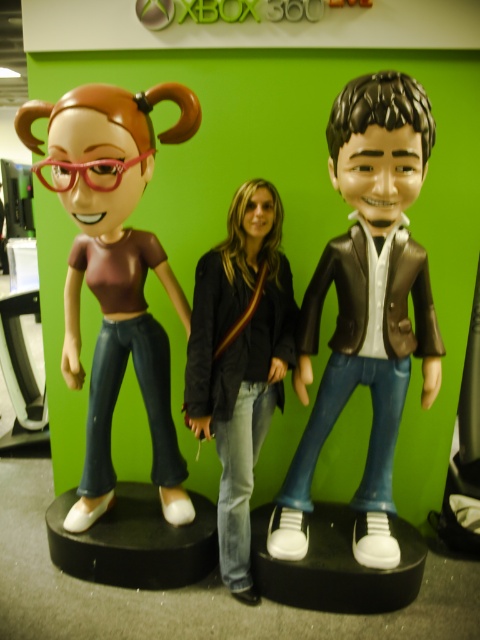
I want to click on matte black bobblehead at right, so click(x=367, y=305).

Locate an element on the screen. The image size is (480, 640). matte black bobblehead at right is located at coordinates (367, 305).

Can you confirm if matte brown bobblehead at left is positioned below denim jeans at center?

Incorrect, matte brown bobblehead at left is not positioned below denim jeans at center.

Who is positioned more to the right, matte brown bobblehead at left or denim jeans at center?

denim jeans at center is more to the right.

The width and height of the screenshot is (480, 640). Describe the element at coordinates (115, 272) in the screenshot. I see `matte brown bobblehead at left` at that location.

At what (x,y) coordinates should I click in order to perform the action: click on matte brown bobblehead at left. Please return your answer as a coordinate pair (x, y). This screenshot has width=480, height=640. Looking at the image, I should click on (115, 272).

Between matte black bobblehead at right and denim jeans at center, which one has less height?

denim jeans at center

Image resolution: width=480 pixels, height=640 pixels. I want to click on matte black bobblehead at right, so click(367, 305).

Which is behind, point (422, 339) or point (230, 566)?

Positioned behind is point (230, 566).

Locate an element on the screen. matte black bobblehead at right is located at coordinates (367, 305).